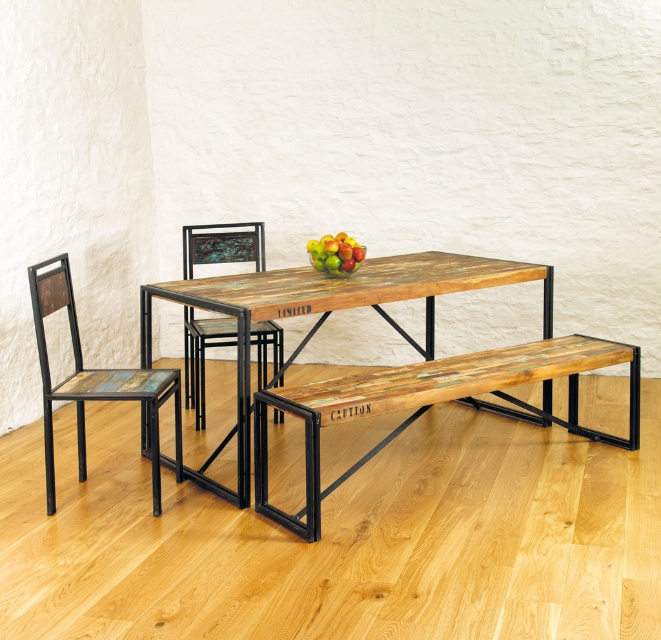
Question: Can you confirm if distressed wood chair at left is smaller than green matte apples at center?

Choices:
 (A) yes
 (B) no

Answer: (B)

Question: Which point is farther from the camera taking this photo?

Choices:
 (A) (268, 307)
 (B) (299, 413)

Answer: (A)

Question: Is reclaimed wood bench at center positioned behind reclaimed wood table at center?

Choices:
 (A) no
 (B) yes

Answer: (A)

Question: Which object is positioned closest to the reclaimed wood bench at center?

Choices:
 (A) reclaimed wood table at center
 (B) green matte apples at center

Answer: (A)

Question: Can you confirm if reclaimed wood bench at center is bigger than reclaimed wood table at center?

Choices:
 (A) yes
 (B) no

Answer: (B)

Question: Which point is closer to the camera taking this photo?

Choices:
 (A) (385, 314)
 (B) (200, 422)
 (C) (83, 406)
 (D) (329, 260)

Answer: (D)